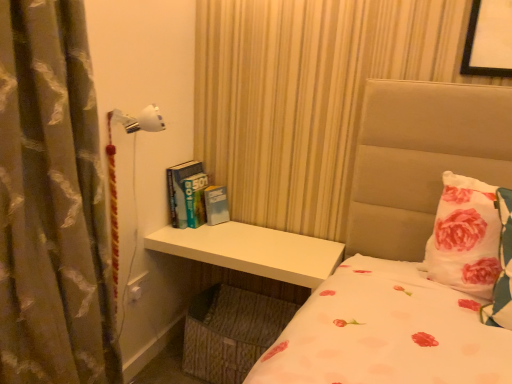
Identify the location of vacant area situated below hardcover books at center (from a real-world perspective). This screenshot has height=384, width=512. (197, 231).